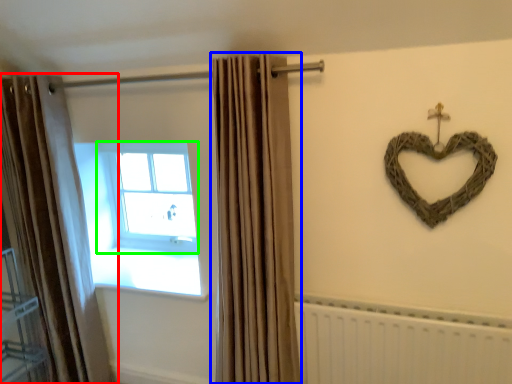
Question: Based on their relative distances, which object is farther from curtain (highlighted by a red box)? Choose from curtain (highlighted by a blue box) and window (highlighted by a green box).

Choices:
 (A) curtain
 (B) window

Answer: (A)